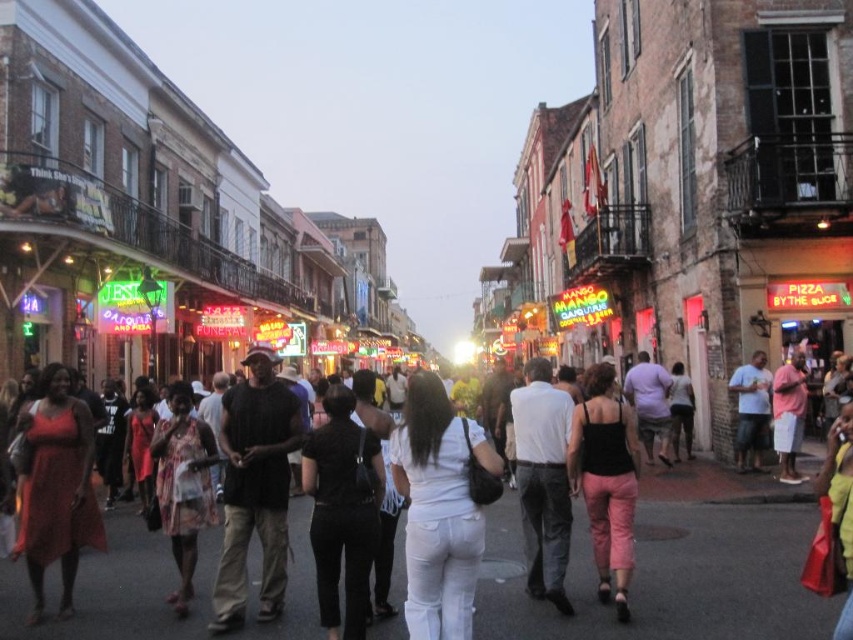
Does white cotton shirt at center appear under matte black shirt at center?

Correct, white cotton shirt at center is located below matte black shirt at center.

Which is behind, point (735, 595) or point (764, 440)?

Point (764, 440)

Is point (113, 598) farther from camera compared to point (749, 385)?

No, (113, 598) is closer to viewer.

Identify the location of white cotton shirt at center. The height and width of the screenshot is (640, 853). (668, 572).

Who is positioned more to the left, white matte pants at center or matte black tank top at center?

From the viewer's perspective, white matte pants at center appears more on the left side.

Is point (473, 563) in front of point (614, 465)?

Yes.

This screenshot has width=853, height=640. What do you see at coordinates (439, 508) in the screenshot?
I see `white matte pants at center` at bounding box center [439, 508].

Identify the location of white matte pants at center. (439, 508).

Consider the image. Does white matte pants at center appear on the right side of matte black shirt at center?

No, white matte pants at center is not to the right of matte black shirt at center.

Does white matte pants at center appear under matte black shirt at center?

Yes.

Is point (489, 454) farther from camera compared to point (753, 422)?

No, it is in front of (753, 422).

Where is `white matte pants at center`? white matte pants at center is located at coordinates (439, 508).